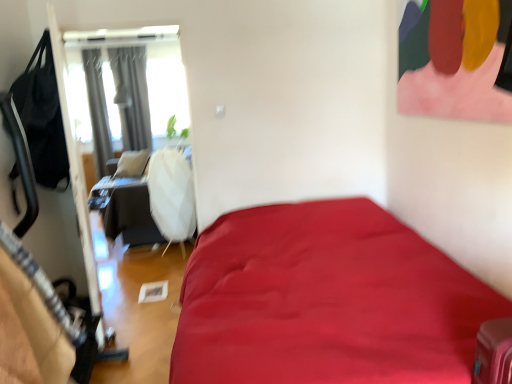
Question: Is gray fabric curtain at upper left, the 1th curtain viewed from the right, outside of gray fabric curtain at upper left, the first curtain positioned from the left?

Choices:
 (A) yes
 (B) no

Answer: (A)

Question: Could you tell me if gray fabric curtain at upper left, the 1th curtain viewed from the right, is turned towards gray fabric curtain at upper left, the first curtain positioned from the left?

Choices:
 (A) no
 (B) yes

Answer: (A)

Question: Can you confirm if gray fabric curtain at upper left, the 1th curtain viewed from the right, is positioned to the left of gray fabric curtain at upper left, the first curtain positioned from the left?

Choices:
 (A) no
 (B) yes

Answer: (A)

Question: Is gray fabric curtain at upper left, positioned as the 2th curtain in left-to-right order, in contact with gray fabric curtain at upper left, the first curtain positioned from the left?

Choices:
 (A) yes
 (B) no

Answer: (B)

Question: Is gray fabric curtain at upper left, the 1th curtain viewed from the right, not near gray fabric curtain at upper left, marked as the 2th curtain in a right-to-left arrangement?

Choices:
 (A) yes
 (B) no

Answer: (B)

Question: Considering the relative positions of gray fabric curtain at upper left, the 1th curtain viewed from the right, and gray fabric curtain at upper left, marked as the 2th curtain in a right-to-left arrangement, in the image provided, is gray fabric curtain at upper left, the 1th curtain viewed from the right, behind gray fabric curtain at upper left, marked as the 2th curtain in a right-to-left arrangement,?

Choices:
 (A) no
 (B) yes

Answer: (B)

Question: Is gray fabric curtain at upper left, marked as the 2th curtain in a right-to-left arrangement, turned away from gray fabric curtain at upper left, the 1th curtain viewed from the right?

Choices:
 (A) no
 (B) yes

Answer: (A)

Question: Can you confirm if gray fabric curtain at upper left, the first curtain positioned from the left, is taller than gray fabric curtain at upper left, positioned as the 2th curtain in left-to-right order?

Choices:
 (A) yes
 (B) no

Answer: (A)

Question: Is gray fabric curtain at upper left, marked as the 2th curtain in a right-to-left arrangement, thinner than gray fabric curtain at upper left, positioned as the 2th curtain in left-to-right order?

Choices:
 (A) no
 (B) yes

Answer: (A)

Question: Is gray fabric curtain at upper left, positioned as the 2th curtain in left-to-right order, located within gray fabric curtain at upper left, the first curtain positioned from the left?

Choices:
 (A) yes
 (B) no

Answer: (B)

Question: Are gray fabric curtain at upper left, marked as the 2th curtain in a right-to-left arrangement, and gray fabric curtain at upper left, the 1th curtain viewed from the right, located far from each other?

Choices:
 (A) yes
 (B) no

Answer: (B)

Question: Is gray fabric curtain at upper left, the first curtain positioned from the left, facing towards gray fabric curtain at upper left, positioned as the 2th curtain in left-to-right order?

Choices:
 (A) no
 (B) yes

Answer: (A)

Question: From a real-world perspective, is gray fabric curtain at upper left, the first curtain positioned from the left, physically located above or below gray fabric curtain at upper left, the 1th curtain viewed from the right?

Choices:
 (A) below
 (B) above

Answer: (A)